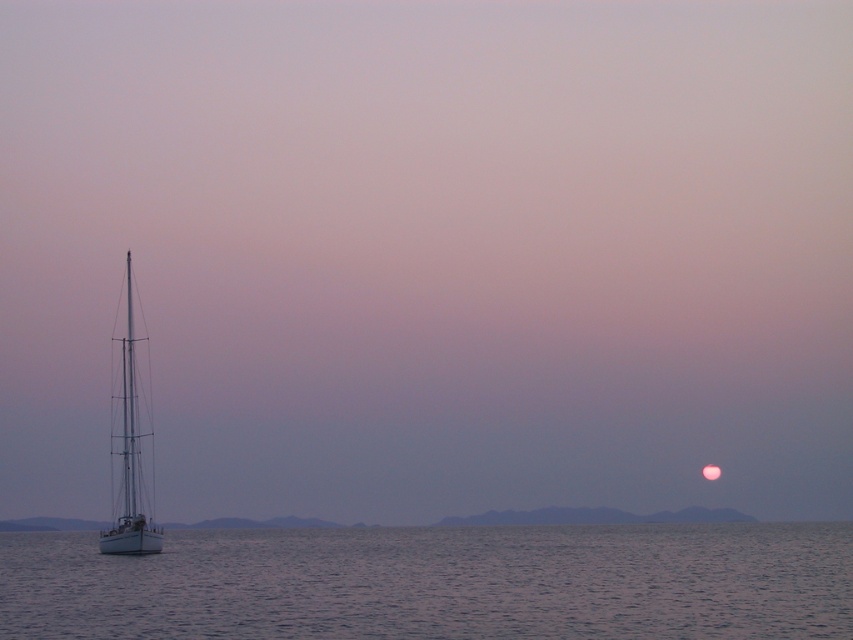
Who is lower down, clear water at lower left or white matte sailboat at left?

clear water at lower left

Does clear water at lower left appear under white matte sailboat at left?

Correct, clear water at lower left is located below white matte sailboat at left.

Locate an element on the screen. The height and width of the screenshot is (640, 853). clear water at lower left is located at coordinates (437, 582).